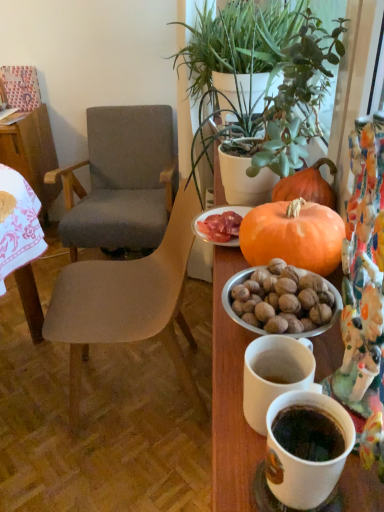
The width and height of the screenshot is (384, 512). What are the coordinates of `free space in front of textured gray fabric chair at left, the 1th chair in the front-to-back sequence` in the screenshot? It's located at (135, 468).